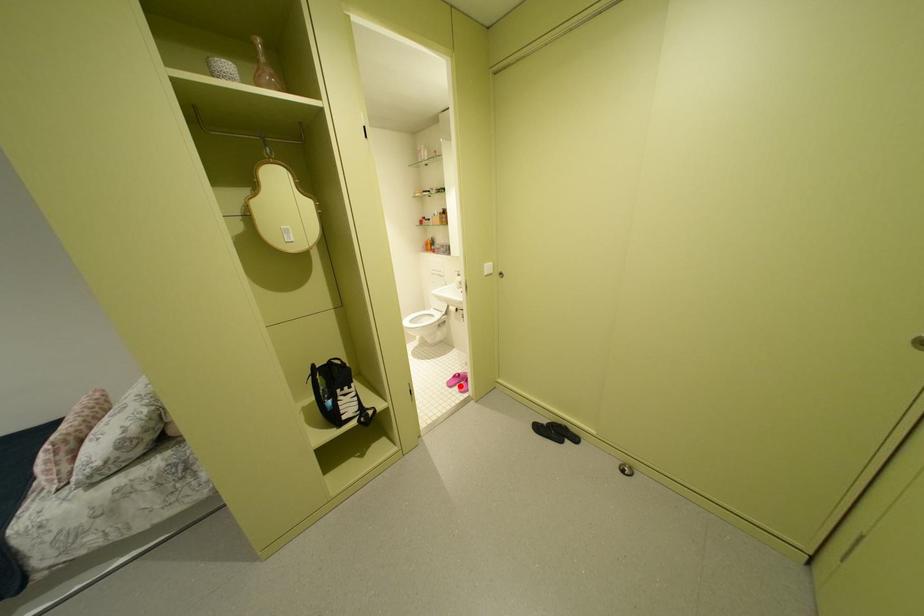
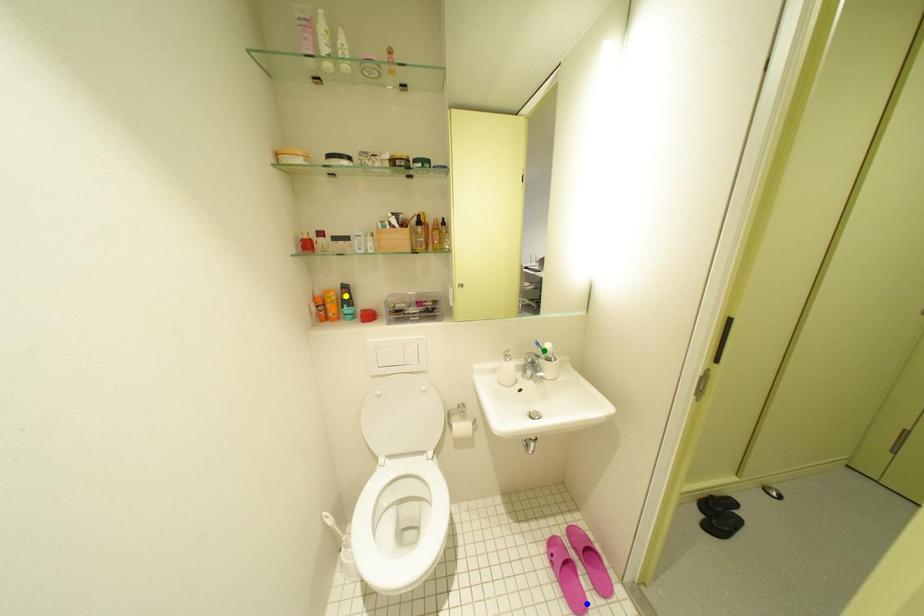
Question: I am providing you with two images of the same scene from different viewpoints. A red point is marked on the first image. You are given multiple points on the second image. Which point in image 2 represents the same 3d spot as the red point in image 1?

Choices:
 (A) green point
 (B) blue point
 (C) yellow point

Answer: (B)